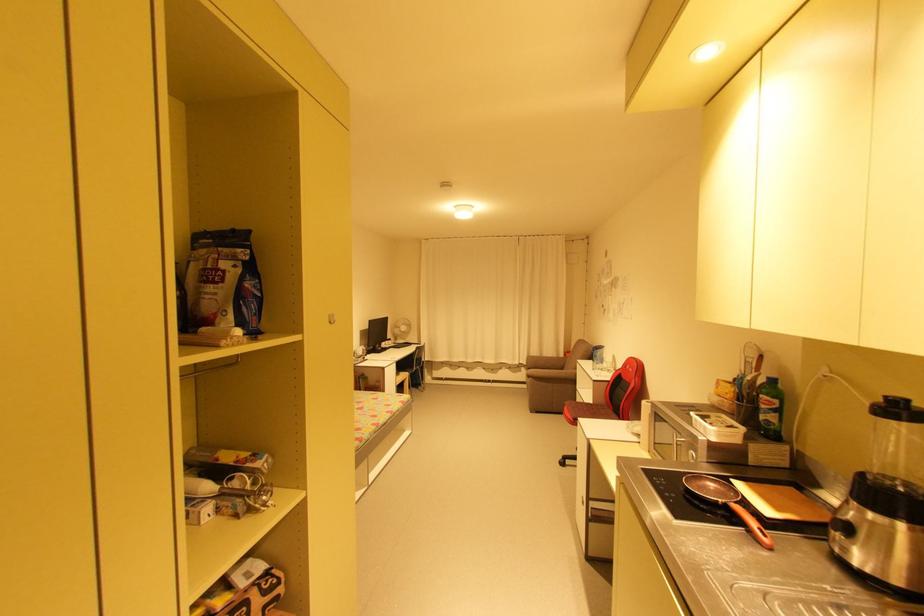
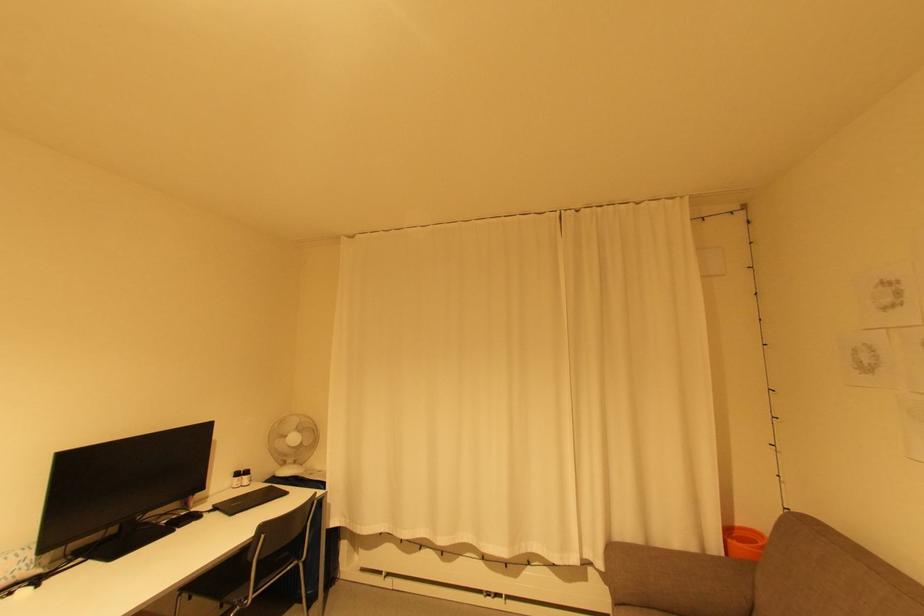
The point at (572,352) is marked in the first image. Where is the corresponding point in the second image?

(733, 533)